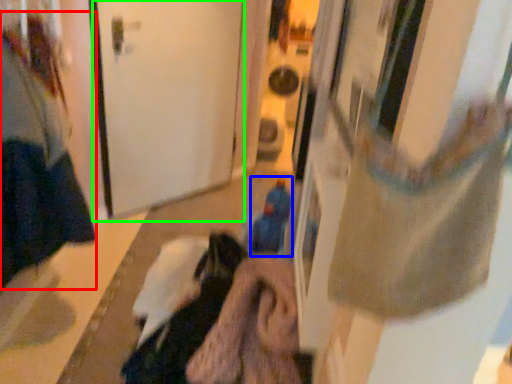
Question: Considering the real-world distances, which object is closest to woman (highlighted by a red box)? toy (highlighted by a blue box) or door (highlighted by a green box).

Choices:
 (A) toy
 (B) door

Answer: (B)